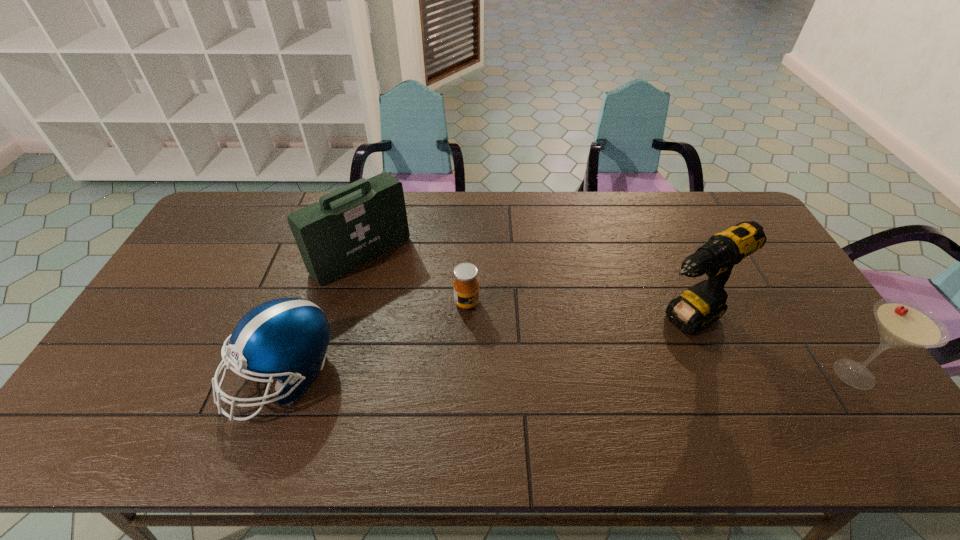
At what (x,y) coordinates should I click in order to perform the action: click on football helmet. Please return your answer as a coordinate pair (x, y). The image size is (960, 540). Looking at the image, I should click on (286, 338).

Locate an element on the screen. The height and width of the screenshot is (540, 960). the rightmost object is located at coordinates click(902, 324).

At what (x,y) coordinates should I click in order to perform the action: click on the farthest object. Please return your answer as a coordinate pair (x, y). Looking at the image, I should click on (350, 226).

Where is `the tallest object`? the tallest object is located at coordinates [x=702, y=304].

Find the location of a particular element. The height and width of the screenshot is (540, 960). the fourth object from left to right is located at coordinates (702, 304).

Where is `the shortest object`? This screenshot has height=540, width=960. the shortest object is located at coordinates (466, 285).

I want to click on honey, so click(466, 285).

Locate an element on the screen. free point located on the left of the rightmost object is located at coordinates (675, 374).

Find the location of a particular element. Image resolution: width=960 pixels, height=540 pixels. free location located 0.350m on the front-facing side of the first-aid kit is located at coordinates (462, 347).

I want to click on vacant space situated 0.280m on the front-facing side of the first-aid kit, so click(x=445, y=332).